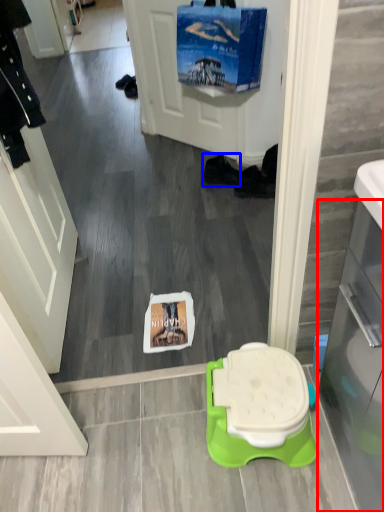
Question: Which of the following is the farthest to the observer, glass door (highlighted by a red box) or footwear (highlighted by a blue box)?

Choices:
 (A) glass door
 (B) footwear

Answer: (B)